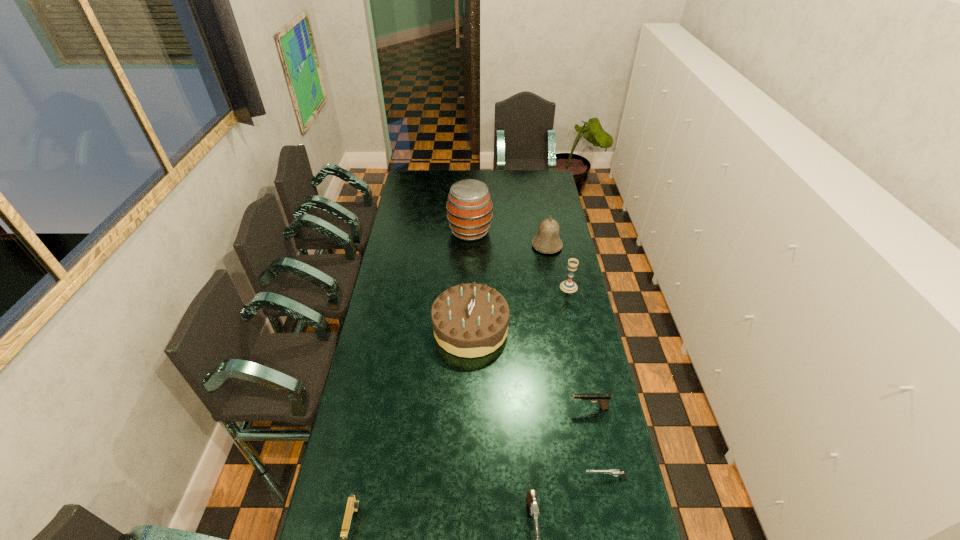
You are a GUI agent. You are given a task and a screenshot of the screen. Output one action in this format:
    pyautogui.click(x=<x>, y=<y>)
    Task: Click on the free location located 0.060m on the front of the sixth nearest object
    This screenshot has height=540, width=960.
    Given the screenshot: What is the action you would take?
    [572, 302]

Find the location of a particular element. Image resolution: width=960 pixels, height=540 pixels. vacant space situated at the muzzle of the farthest pistol is located at coordinates (464, 408).

Locate an element on the screen. This screenshot has width=960, height=540. free space located at the muzzle of the farthest pistol is located at coordinates (490, 408).

The height and width of the screenshot is (540, 960). Identify the location of vacant space located 0.300m at the muzzle of the farthest pistol. (487, 408).

Find the location of a particular element. vacant space located on the front-facing side of the shortest pistol is located at coordinates (479, 478).

Image resolution: width=960 pixels, height=540 pixels. I want to click on vacant space located 0.100m on the front-facing side of the shortest pistol, so click(x=552, y=478).

In order to click on free space located 0.170m on the front-facing side of the shortest pistol in this screenshot , I will do `click(530, 478)`.

At what (x,y) coordinates should I click in order to perform the action: click on bell present at the right edge. Please return your answer as a coordinate pair (x, y). This screenshot has width=960, height=540. Looking at the image, I should click on (547, 240).

The width and height of the screenshot is (960, 540). Find the location of `chalice that is at the right edge`. chalice that is at the right edge is located at coordinates (568, 286).

At what (x,y) coordinates should I click in order to perform the action: click on vacant area at the far edge of the desktop. Please return your answer as a coordinate pair (x, y). This screenshot has height=540, width=960. Looking at the image, I should click on (492, 170).